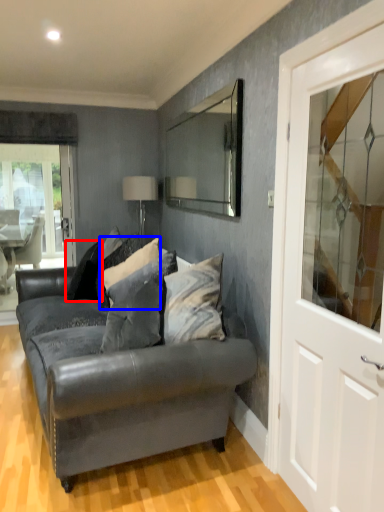
Question: Which object appears farthest to the camera in this image, pillow (highlighted by a red box) or pillow (highlighted by a blue box)?

Choices:
 (A) pillow
 (B) pillow

Answer: (A)